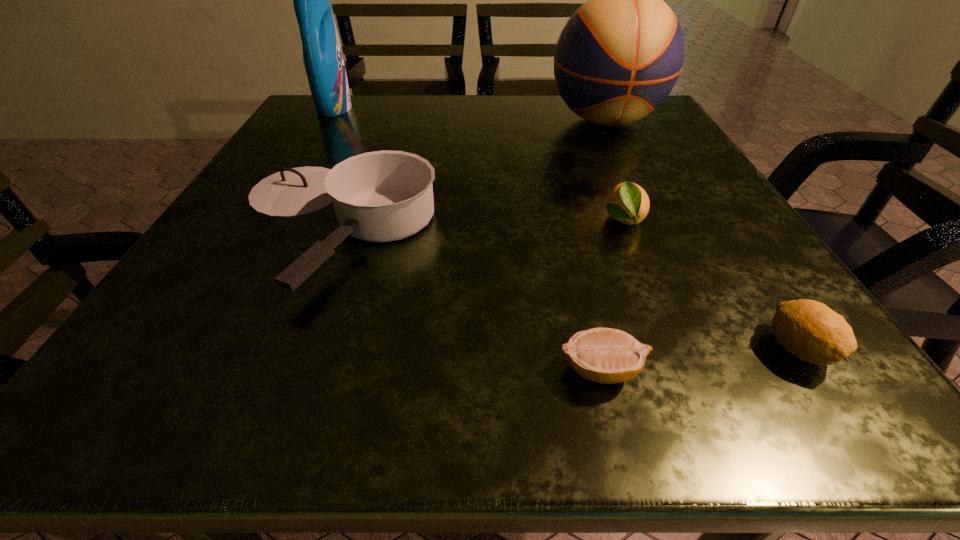
In order to click on free space between the farthest lemon and the leftmost lemon in this screenshot , I will do `click(612, 295)`.

Image resolution: width=960 pixels, height=540 pixels. I want to click on free space between the leftmost lemon and the second lemon from right to left, so click(x=612, y=295).

Image resolution: width=960 pixels, height=540 pixels. In order to click on vacant point located between the shortest object and the rightmost lemon in this screenshot , I will do `click(699, 359)`.

Identify the location of vacant space that's between the detergent and the saucepan. (333, 166).

The image size is (960, 540). What are the coordinates of `free spot between the basketball and the second lemon from left to right` in the screenshot? It's located at (613, 171).

Where is `free space between the basketball and the rightmost lemon`? The width and height of the screenshot is (960, 540). free space between the basketball and the rightmost lemon is located at coordinates (701, 234).

At what (x,y) coordinates should I click in order to perform the action: click on vacant point located between the detergent and the farthest lemon. Please return your answer as a coordinate pair (x, y). This screenshot has height=540, width=960. Looking at the image, I should click on (478, 164).

Where is `object that is the second closest to the rightmost lemon`? Image resolution: width=960 pixels, height=540 pixels. object that is the second closest to the rightmost lemon is located at coordinates (629, 204).

Identify which object is located as the fifth nearest to the shortest object. Please provide its 2D coordinates. Your answer should be formatted as a tuple, i.e. [(x, y)], where the tuple contains the x and y coordinates of a point satisfying the conditions above.

[(322, 55)]

Point out which lemon is positioned as the third nearest to the basketball. Please provide its 2D coordinates. Your answer should be formatted as a tuple, i.e. [(x, y)], where the tuple contains the x and y coordinates of a point satisfying the conditions above.

[(604, 355)]